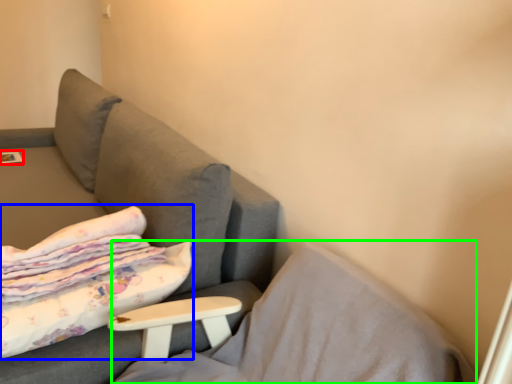
Question: Which is farther away from magazine (highlighted by a red box)? bed (highlighted by a blue box) or pillow (highlighted by a green box)?

Choices:
 (A) bed
 (B) pillow

Answer: (B)